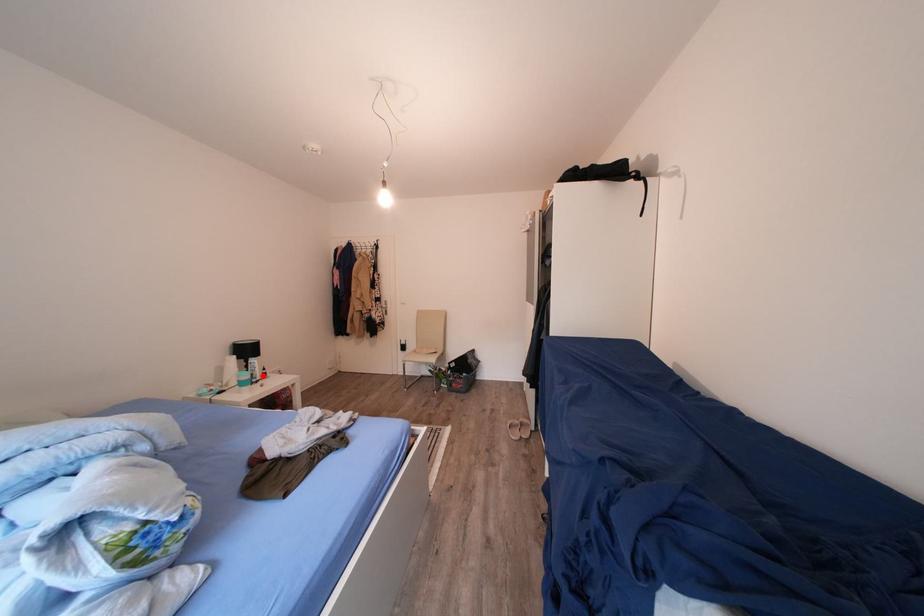
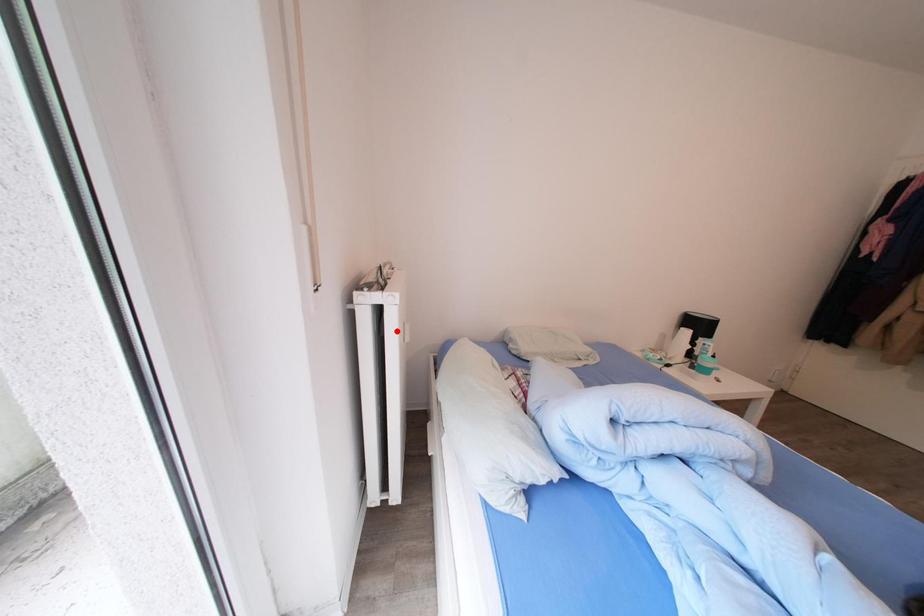
I am providing you with two images of the same scene from different viewpoints. A red point is marked on the first image and another point is marked on the second image. Do the highlighted points in image1 and image2 indicate the same real-world spot?

No